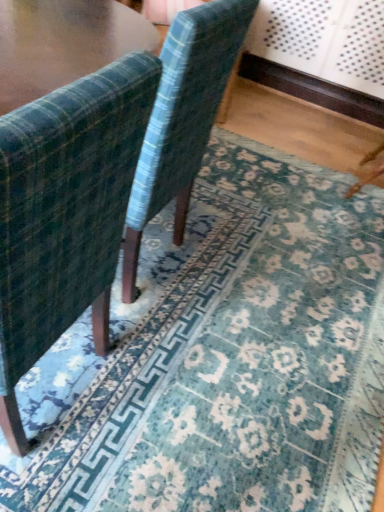
Question: Is velvet green chair at left, which is counted as the 2th chair, starting from the back, far away from velvet-like green chair at center, positioned as the 2th chair in front-to-back order?

Choices:
 (A) yes
 (B) no

Answer: (B)

Question: Does velvet green chair at left, the first chair viewed from the front, have a lesser height compared to velvet-like green chair at center, which is the 1th chair from back to front?

Choices:
 (A) yes
 (B) no

Answer: (B)

Question: Is velvet green chair at left, which is counted as the 2th chair, starting from the back, turned away from velvet-like green chair at center, which is the 1th chair from back to front?

Choices:
 (A) yes
 (B) no

Answer: (B)

Question: From a real-world perspective, is velvet green chair at left, which is counted as the 2th chair, starting from the back, on top of velvet-like green chair at center, positioned as the 2th chair in front-to-back order?

Choices:
 (A) no
 (B) yes

Answer: (B)

Question: Does velvet green chair at left, which is counted as the 2th chair, starting from the back, appear on the right side of velvet-like green chair at center, which is the 1th chair from back to front?

Choices:
 (A) no
 (B) yes

Answer: (A)

Question: Is velvet-like green chair at center, which is the 1th chair from back to front, surrounded by velvet green chair at left, the first chair viewed from the front?

Choices:
 (A) yes
 (B) no

Answer: (B)

Question: Considering the relative sizes of velvet-like green chair at center, which is the 1th chair from back to front, and velvet green chair at left, which is counted as the 2th chair, starting from the back, in the image provided, is velvet-like green chair at center, which is the 1th chair from back to front, thinner than velvet green chair at left, which is counted as the 2th chair, starting from the back,?

Choices:
 (A) yes
 (B) no

Answer: (A)

Question: From a real-world perspective, is velvet-like green chair at center, positioned as the 2th chair in front-to-back order, located beneath velvet green chair at left, which is counted as the 2th chair, starting from the back?

Choices:
 (A) yes
 (B) no

Answer: (A)

Question: From a real-world perspective, is velvet-like green chair at center, positioned as the 2th chair in front-to-back order, over velvet green chair at left, the first chair viewed from the front?

Choices:
 (A) no
 (B) yes

Answer: (A)

Question: Does velvet-like green chair at center, which is the 1th chair from back to front, turn towards velvet green chair at left, the first chair viewed from the front?

Choices:
 (A) yes
 (B) no

Answer: (B)

Question: Considering the relative sizes of velvet-like green chair at center, which is the 1th chair from back to front, and velvet green chair at left, which is counted as the 2th chair, starting from the back, in the image provided, is velvet-like green chair at center, which is the 1th chair from back to front, wider than velvet green chair at left, which is counted as the 2th chair, starting from the back,?

Choices:
 (A) no
 (B) yes

Answer: (A)

Question: Can velvet green chair at left, the first chair viewed from the front, be found inside velvet-like green chair at center, positioned as the 2th chair in front-to-back order?

Choices:
 (A) no
 (B) yes

Answer: (A)

Question: Is point (54, 266) positioned closer to the camera than point (203, 138)?

Choices:
 (A) closer
 (B) farther

Answer: (A)